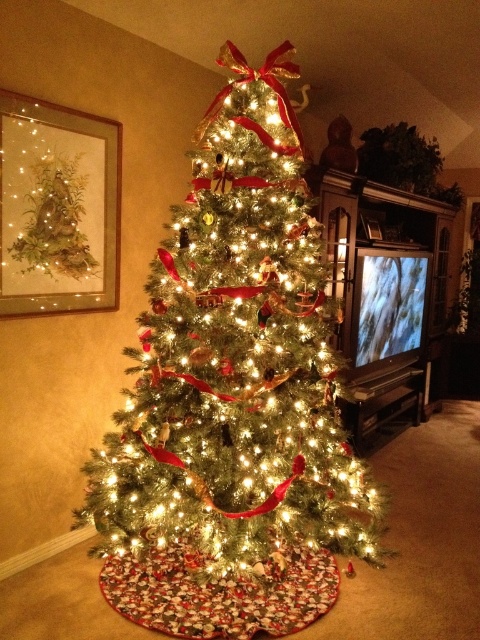
Where is the iridescent glass christmas tree at center located in the image?

The iridescent glass christmas tree at center is located at point (237, 358) in the image.

You are a guest at a Christmas party and want to take a photo with the iridescent glass christmas tree at center and the matte glass painting at upper left. Since you need to ensure both are in the frame, can you tell me which object is taller so I can adjust my camera angle accordingly?

The iridescent glass christmas tree at center is much taller than the matte glass painting at upper left, so you should angle your camera downward to include both in the frame.